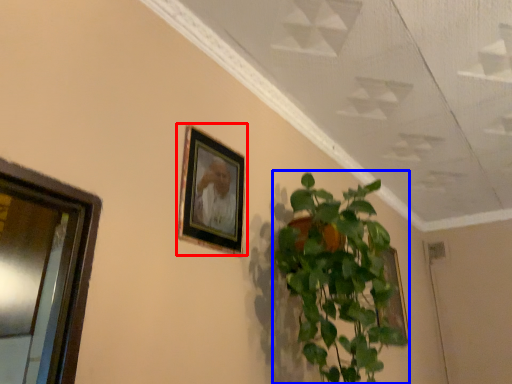
Question: Among these objects, which one is farthest to the camera, picture frame (highlighted by a red box) or houseplant (highlighted by a blue box)?

Choices:
 (A) picture frame
 (B) houseplant

Answer: (A)